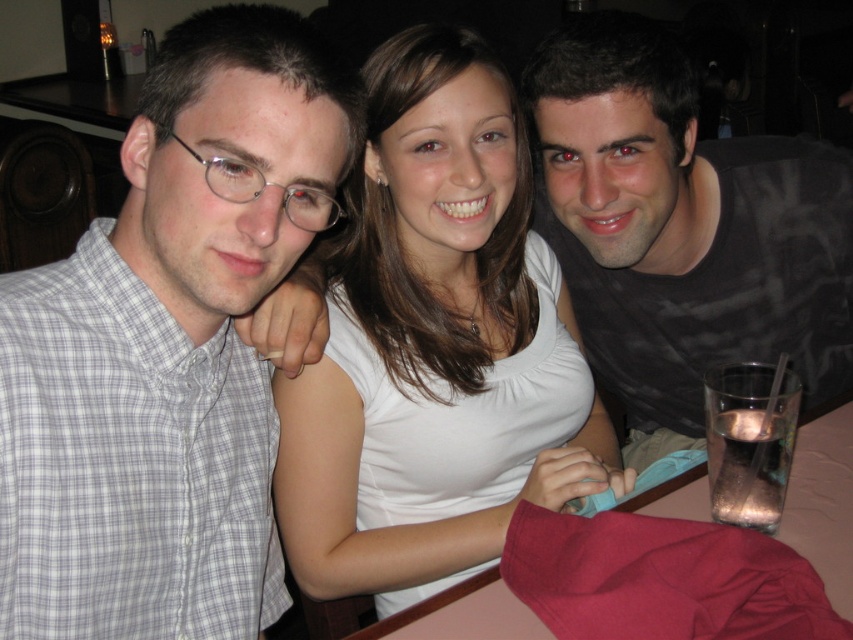
You are a photographer standing behind the group of three people. You want to take a photo of the smooth plastic table at lower right without any of the gray checkered shirt at left blocking it. Is this possible?

The gray checkered shirt at left is much taller than the smooth plastic table at lower right, so it might block the view. To take a photo of the smooth plastic table at lower right without the gray checkered shirt at left blocking it, you would need to position yourself lower or move the table so that the shirt is no longer in the way.

You are a photographer taking a picture of the matte black shirt at upper right and the smooth plastic table at lower right. Which object should you focus on first if you want to capture both in focus without moving the camera?

The matte black shirt at upper right is above the smooth plastic table at lower right, so you should focus on the smooth plastic table at lower right first since it is closer to the camera. This way, the depth of field may include both objects in focus.

You are a server at a restaurant. You need to place a 10 inch dessert plate between the white smooth shirt at center and the matte black shirt at upper right. Can you fit it there?

The distance between the white smooth shirt at center and the matte black shirt at upper right is 9.13 inches, so the 10 inch dessert plate cannot be placed between them as it is wider than the available space.